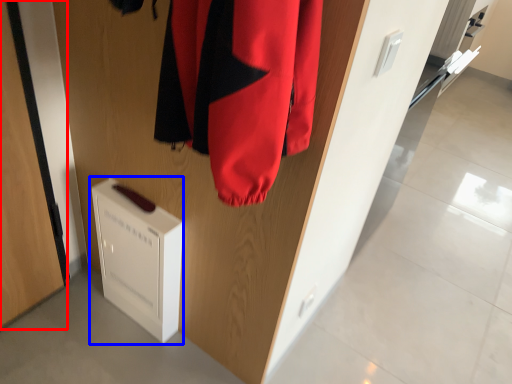
Question: Which object is further to the camera taking this photo, door (highlighted by a red box) or appliance (highlighted by a blue box)?

Choices:
 (A) door
 (B) appliance

Answer: (B)